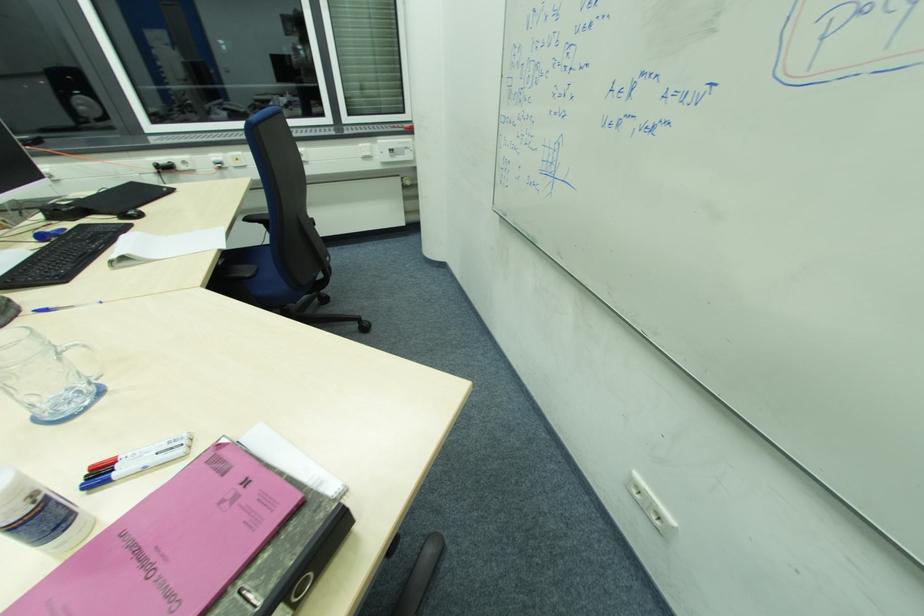
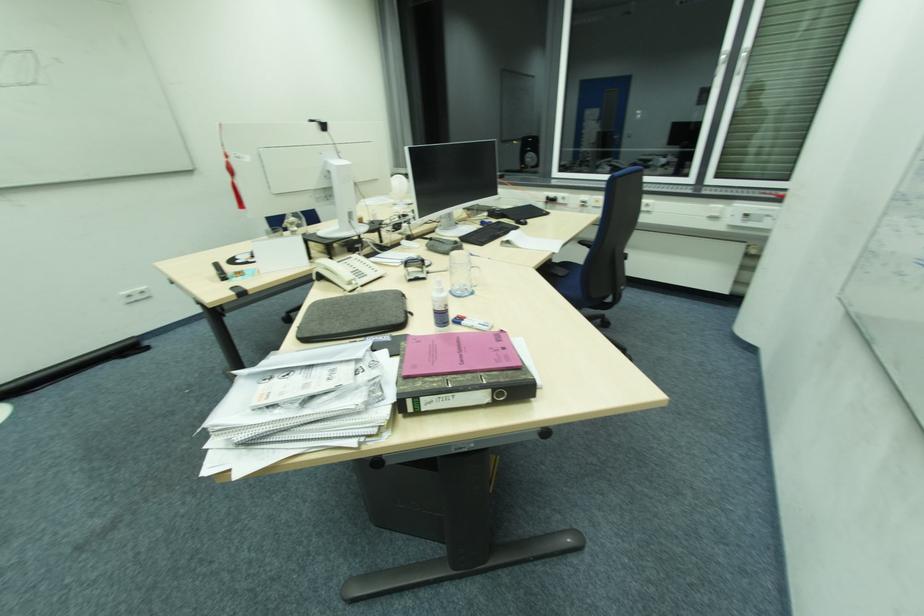
In the second image, find the point that corresponds to (204,286) in the first image.

(539, 268)